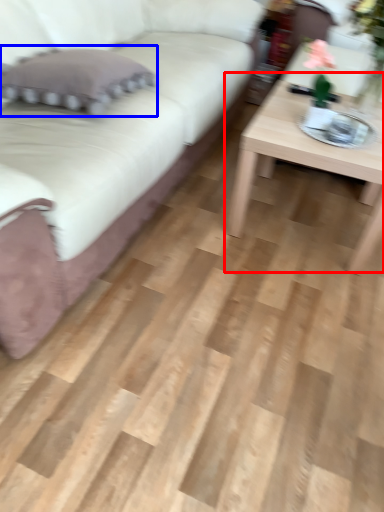
Question: Which object appears farthest to the camera in this image, coffee table (highlighted by a red box) or pillow (highlighted by a blue box)?

Choices:
 (A) coffee table
 (B) pillow

Answer: (A)